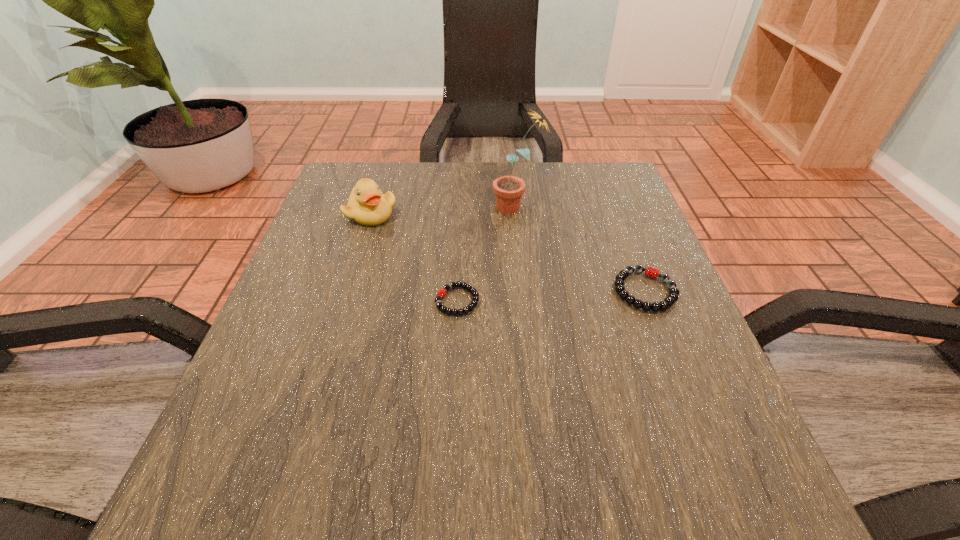
Where is `the tallest object`? This screenshot has height=540, width=960. the tallest object is located at coordinates (508, 189).

Where is `sunflower`? The height and width of the screenshot is (540, 960). sunflower is located at coordinates (508, 189).

Locate an element on the screen. The height and width of the screenshot is (540, 960). duckling is located at coordinates (367, 206).

This screenshot has width=960, height=540. In order to click on the second tallest object in this screenshot , I will do `click(367, 206)`.

Where is `the second shortest object`? This screenshot has height=540, width=960. the second shortest object is located at coordinates (651, 272).

In order to click on the rightmost object in this screenshot , I will do `click(651, 272)`.

Where is `the third object from right to left`? the third object from right to left is located at coordinates (441, 293).

I want to click on the shortest object, so click(x=441, y=293).

Locate an element on the screen. This screenshot has width=960, height=540. free space located 0.250m on the flower of the third object from left to right is located at coordinates (386, 207).

The image size is (960, 540). Find the location of `free spot located 0.120m on the flower of the third object from left to right`. free spot located 0.120m on the flower of the third object from left to right is located at coordinates (441, 207).